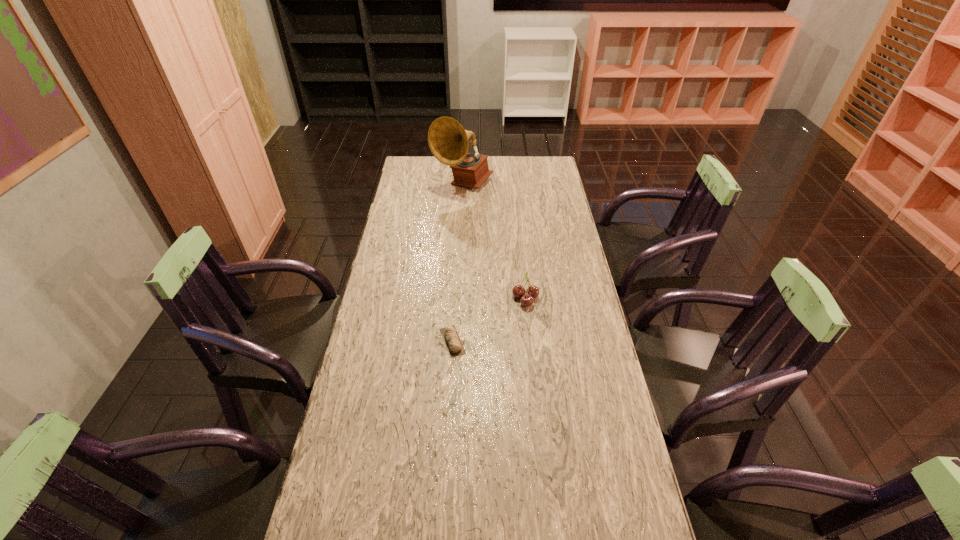
Locate an element on the screen. The image size is (960, 540). phonograph record is located at coordinates (448, 141).

The image size is (960, 540). Identify the location of the farthest object. (448, 141).

Identify the location of the rightmost object. The height and width of the screenshot is (540, 960). (532, 292).

Find the location of a particular element. the second shortest object is located at coordinates (532, 292).

Where is `pita bread`? Image resolution: width=960 pixels, height=540 pixels. pita bread is located at coordinates pyautogui.click(x=450, y=336).

The image size is (960, 540). I want to click on the shortest object, so click(450, 336).

This screenshot has height=540, width=960. In order to click on blank area located 0.120m on the horn of the phonograph record in this screenshot , I will do `click(461, 215)`.

The width and height of the screenshot is (960, 540). I want to click on vacant space situated 0.330m on the leaves of the second farthest object, so click(418, 298).

This screenshot has width=960, height=540. I want to click on free spot located 0.050m on the leaves of the second farthest object, so click(497, 298).

Find the location of a particular element. Image resolution: width=960 pixels, height=540 pixels. free spot located 0.280m on the leaves of the second farthest object is located at coordinates (432, 298).